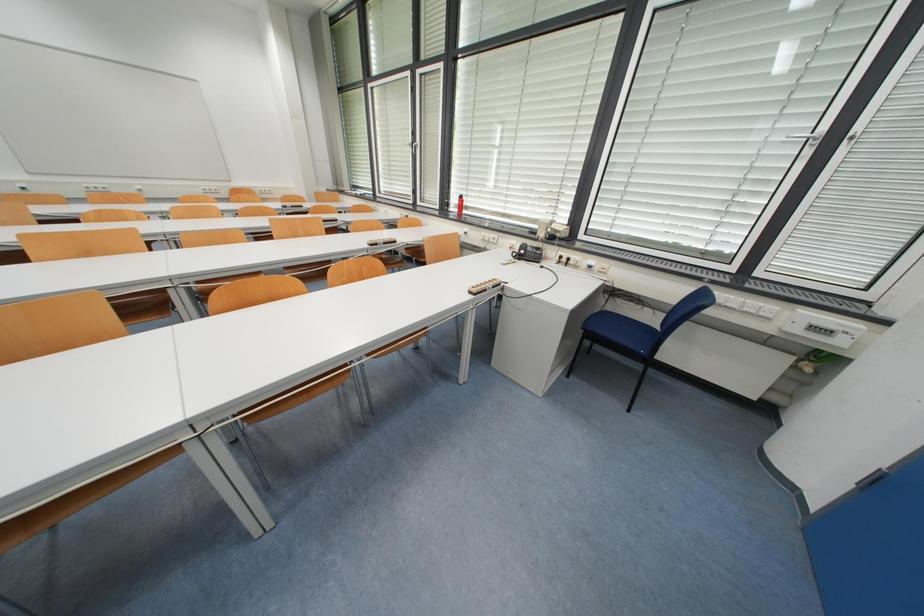
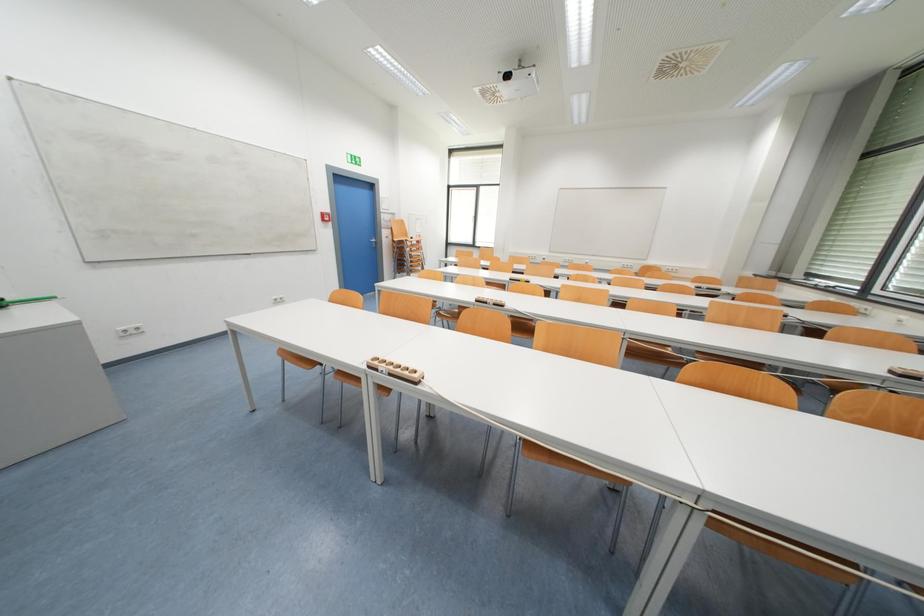
Question: Based on the continuous images, in which direction is the camera rotating? Reply with the corresponding letter.

Choices:
 (A) Left
 (B) Right
 (C) Up
 (D) Down

Answer: (A)